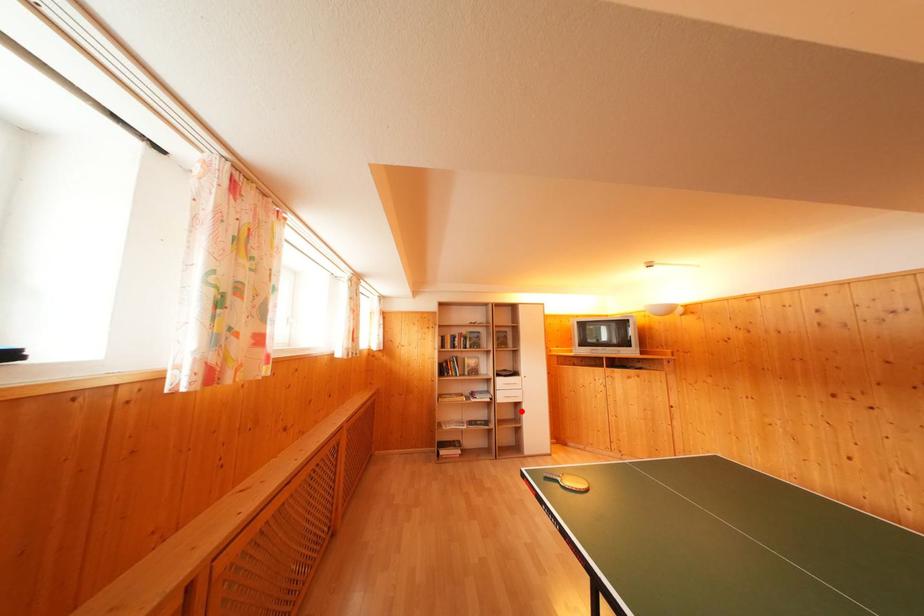
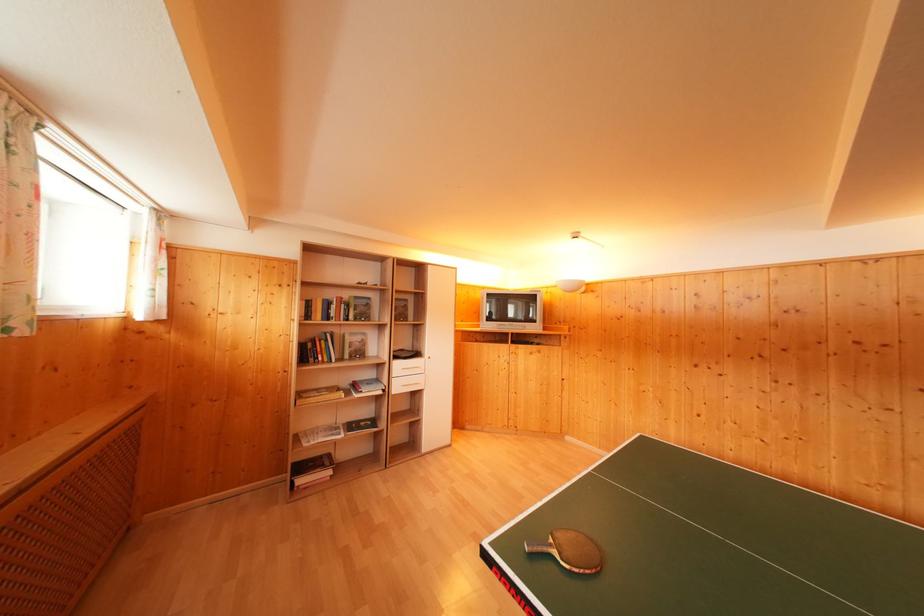
Locate, in the second image, the point that corresponds to the highlighted location in the first image.

(420, 400)